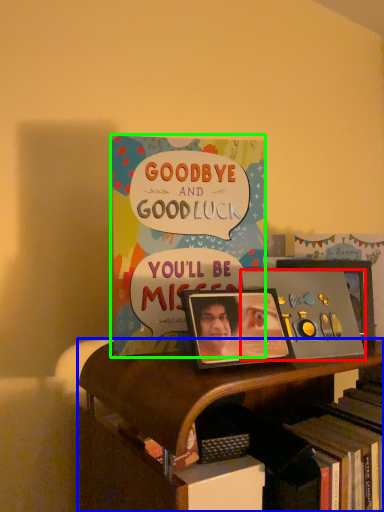
Question: Based on their relative distances, which object is nearer to album cover (highlighted by a red box)? Choose from bookcase (highlighted by a blue box) and book (highlighted by a green box).

Choices:
 (A) bookcase
 (B) book

Answer: (B)